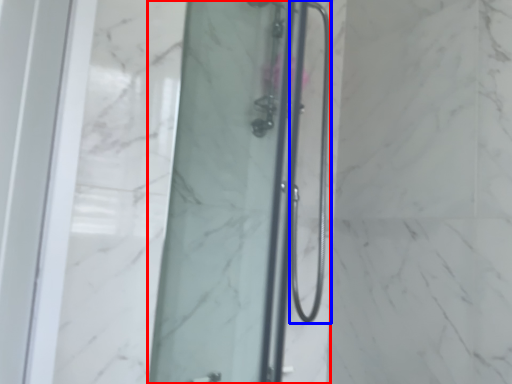
Question: Which object appears farthest to the camera in this image, shower door (highlighted by a red box) or shower door (highlighted by a blue box)?

Choices:
 (A) shower door
 (B) shower door

Answer: (B)